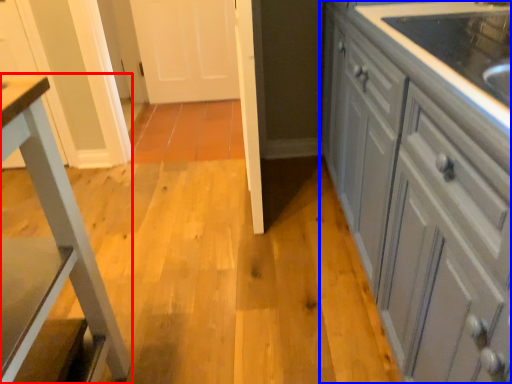
Question: Which of the following is the closest to the observer, furniture (highlighted by a red box) or cabinetry (highlighted by a blue box)?

Choices:
 (A) furniture
 (B) cabinetry

Answer: (B)